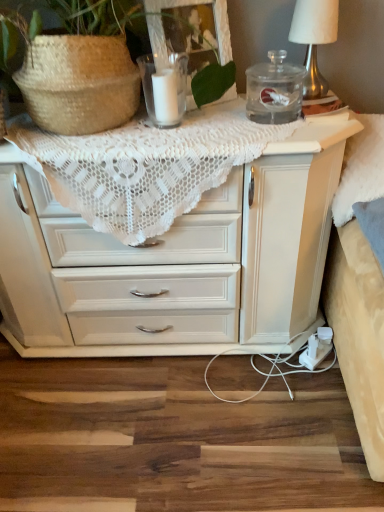
Question: Does white lace doily at upper center appear on the right side of clear glass candle at upper center?

Choices:
 (A) no
 (B) yes

Answer: (A)

Question: From the image's perspective, does white lace doily at upper center appear higher than clear glass candle at upper center?

Choices:
 (A) no
 (B) yes

Answer: (A)

Question: From a real-world perspective, is white lace doily at upper center physically below clear glass candle at upper center?

Choices:
 (A) no
 (B) yes

Answer: (B)

Question: Would you say white lace doily at upper center is a long distance from clear glass candle at upper center?

Choices:
 (A) no
 (B) yes

Answer: (A)

Question: From a real-world perspective, is white lace doily at upper center positioned over clear glass candle at upper center based on gravity?

Choices:
 (A) yes
 (B) no

Answer: (B)

Question: Can you confirm if white lace doily at upper center is wider than clear glass candle at upper center?

Choices:
 (A) no
 (B) yes

Answer: (B)

Question: Considering the relative sizes of clear glass candle at upper center and white fabric-covered lampshade at upper right in the image provided, is clear glass candle at upper center bigger than white fabric-covered lampshade at upper right?

Choices:
 (A) yes
 (B) no

Answer: (B)

Question: From the image's perspective, is clear glass candle at upper center located above white fabric-covered lampshade at upper right?

Choices:
 (A) yes
 (B) no

Answer: (B)

Question: Can you confirm if clear glass candle at upper center is taller than white fabric-covered lampshade at upper right?

Choices:
 (A) no
 (B) yes

Answer: (A)

Question: From a real-world perspective, is clear glass candle at upper center physically above white fabric-covered lampshade at upper right?

Choices:
 (A) no
 (B) yes

Answer: (A)

Question: From a real-world perspective, is clear glass candle at upper center below white fabric-covered lampshade at upper right?

Choices:
 (A) yes
 (B) no

Answer: (A)

Question: Is clear glass candle at upper center far away from white fabric-covered lampshade at upper right?

Choices:
 (A) no
 (B) yes

Answer: (A)

Question: Is transparent glass jar at upper right positioned far away from white lace doily at upper center?

Choices:
 (A) no
 (B) yes

Answer: (A)